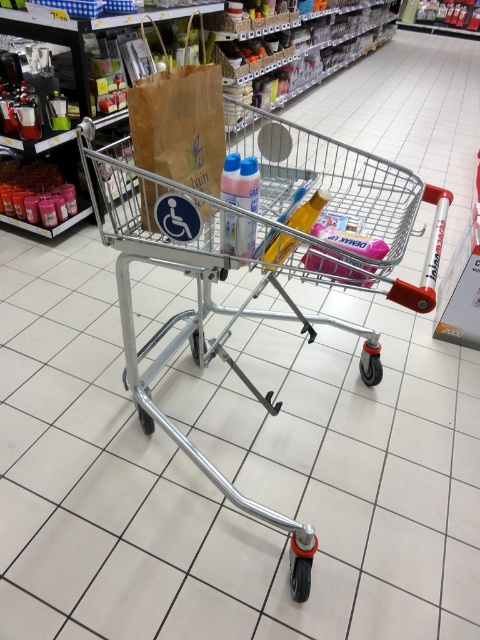
In the scene shown: Is silver metallic trolley at center above brown paper bag at center?

Correct, silver metallic trolley at center is located above brown paper bag at center.

Does silver metallic trolley at center have a lesser height compared to brown paper bag at center?

No, silver metallic trolley at center is not shorter than brown paper bag at center.

Identify the location of silver metallic trolley at center. The width and height of the screenshot is (480, 640). (261, 257).

Identify the location of silver metallic trolley at center. This screenshot has width=480, height=640. (261, 257).